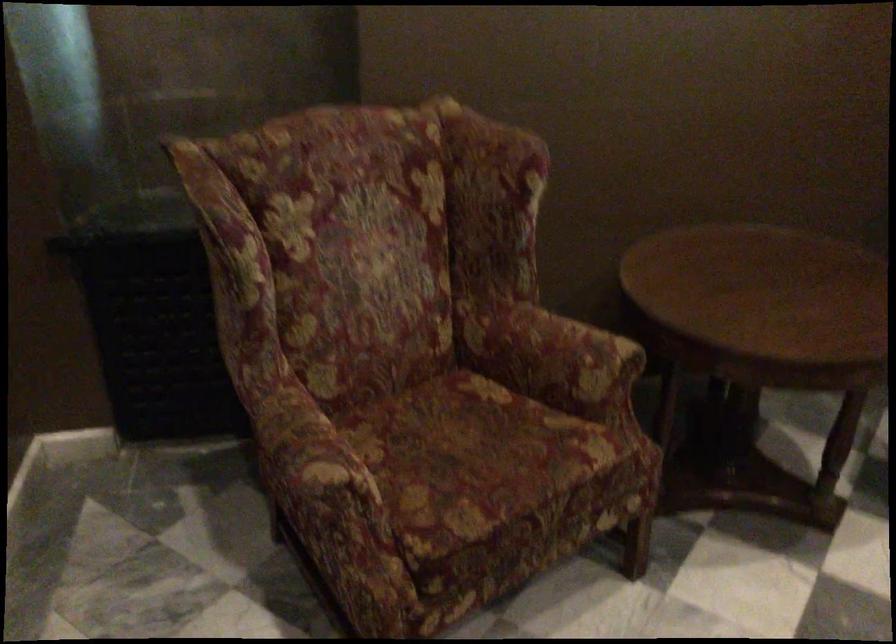
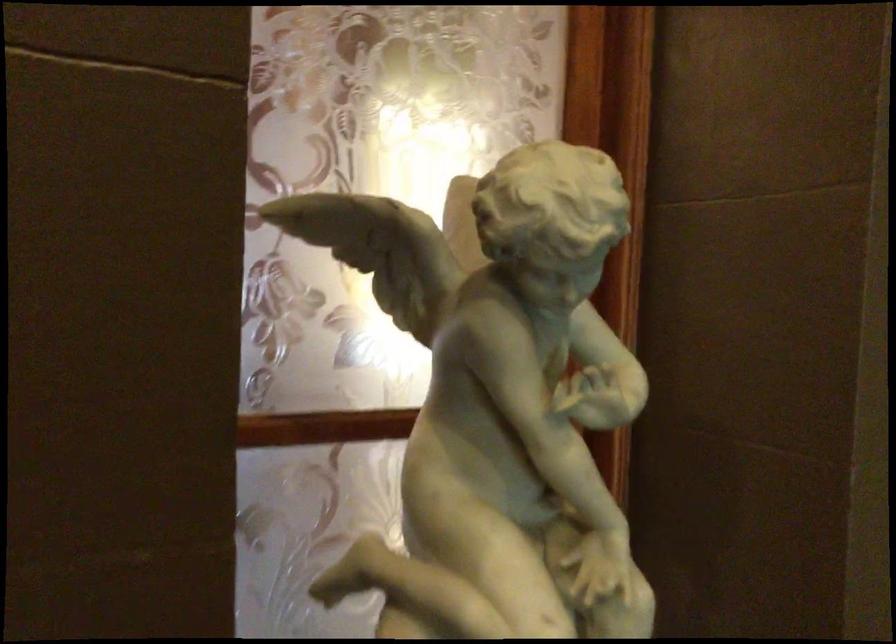
Question: The camera is either moving clockwise (left) or counter-clockwise (right) around the object. The first image is from the beginning of the video and the second image is from the end. Is the camera moving left or right when shooting the video?

Choices:
 (A) Left
 (B) Right

Answer: (B)